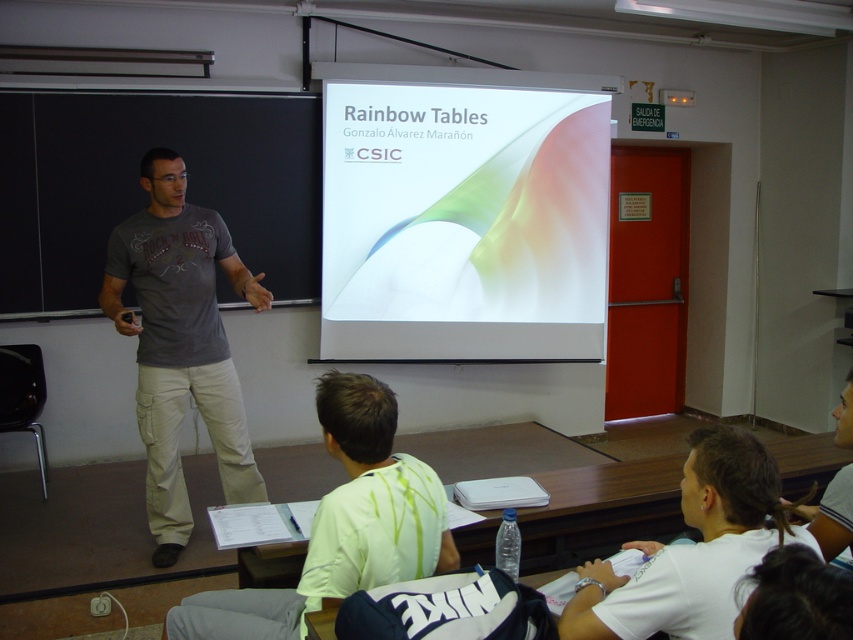
Question: Which of the following is the closest to the observer?

Choices:
 (A) white cotton shirt at lower right
 (B) gray cotton t-shirt at center
 (C) white glossy projection screen at center
 (D) light green fabric shirt at lower center

Answer: (A)

Question: In this image, where is white glossy projection screen at center located relative to white cotton shirt at lower right?

Choices:
 (A) right
 (B) left

Answer: (B)

Question: Considering the relative positions of white glossy projection screen at center and gray cotton t-shirt at center in the image provided, where is white glossy projection screen at center located with respect to gray cotton t-shirt at center?

Choices:
 (A) above
 (B) below

Answer: (A)

Question: Which point is farther to the camera?

Choices:
 (A) (712, 625)
 (B) (326, 396)
 (C) (107, 118)

Answer: (C)

Question: Which of these objects is positioned closest to the white cotton shirt at lower right?

Choices:
 (A) gray cotton t-shirt at center
 (B) blackboard at left
 (C) light green fabric shirt at lower center

Answer: (C)

Question: Does light green fabric shirt at lower center appear under white cotton shirt at lower right?

Choices:
 (A) yes
 (B) no

Answer: (A)